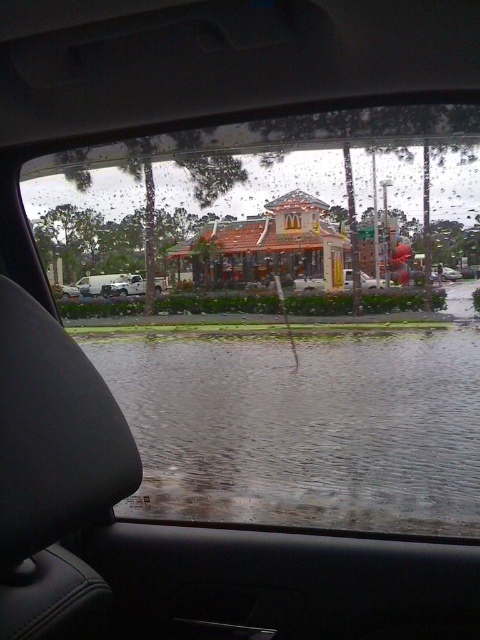
Question: Among these points, which one is nearest to the camera?

Choices:
 (A) (134, 276)
 (B) (371, 500)
 (C) (192, 436)

Answer: (B)

Question: Is the position of transparent glass car window at center more distant than that of white matte truck at lower left?

Choices:
 (A) no
 (B) yes

Answer: (A)

Question: Estimate the real-world distances between objects in this image. Which object is closer to the transparent glass car window at center?

Choices:
 (A) clear water at lower center
 (B) white matte truck at lower left

Answer: (B)

Question: Which of these objects is positioned farthest from the transparent glass car window at center?

Choices:
 (A) white matte truck at lower left
 (B) clear water at lower center

Answer: (B)

Question: Does transparent glass car window at center appear under clear water at lower center?

Choices:
 (A) no
 (B) yes

Answer: (A)

Question: Does transparent glass car window at center come behind clear water at lower center?

Choices:
 (A) no
 (B) yes

Answer: (A)